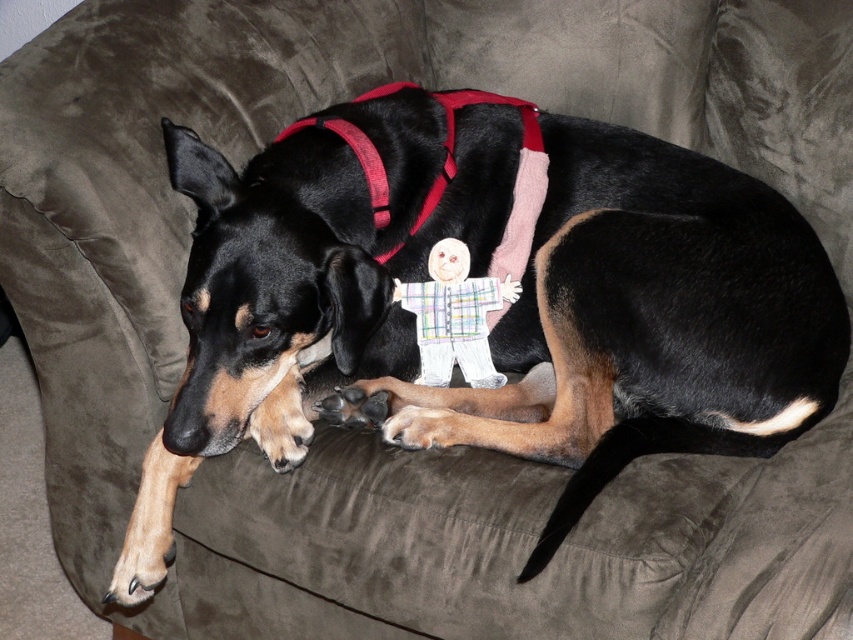
Can you confirm if black smooth dog at center is shorter than plaid fabric doll at center?

Incorrect, black smooth dog at center's height does not fall short of plaid fabric doll at center's.

Which of these two, black smooth dog at center or plaid fabric doll at center, stands shorter?

Standing shorter between the two is plaid fabric doll at center.

Is point (525, 138) closer to viewer compared to point (427, 378)?

That is False.

Find the location of `black smooth dog at center`. black smooth dog at center is located at coordinates (498, 312).